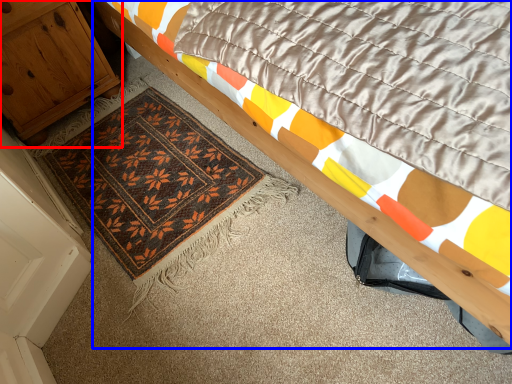
Question: Among these objects, which one is farthest to the camera, cabinetry (highlighted by a red box) or bed (highlighted by a blue box)?

Choices:
 (A) cabinetry
 (B) bed

Answer: (A)